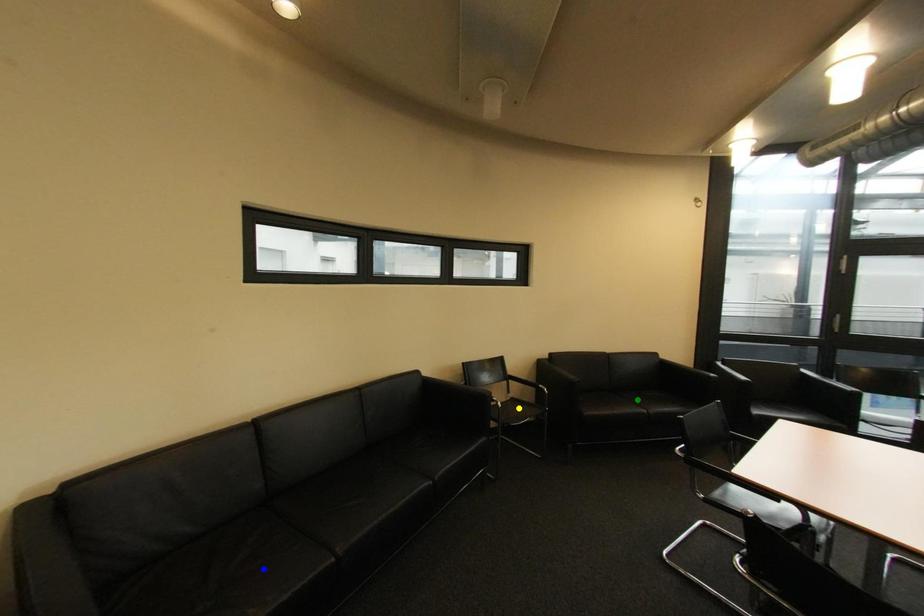
Order these from farthest to nearest:
green point, blue point, yellow point

yellow point < green point < blue point